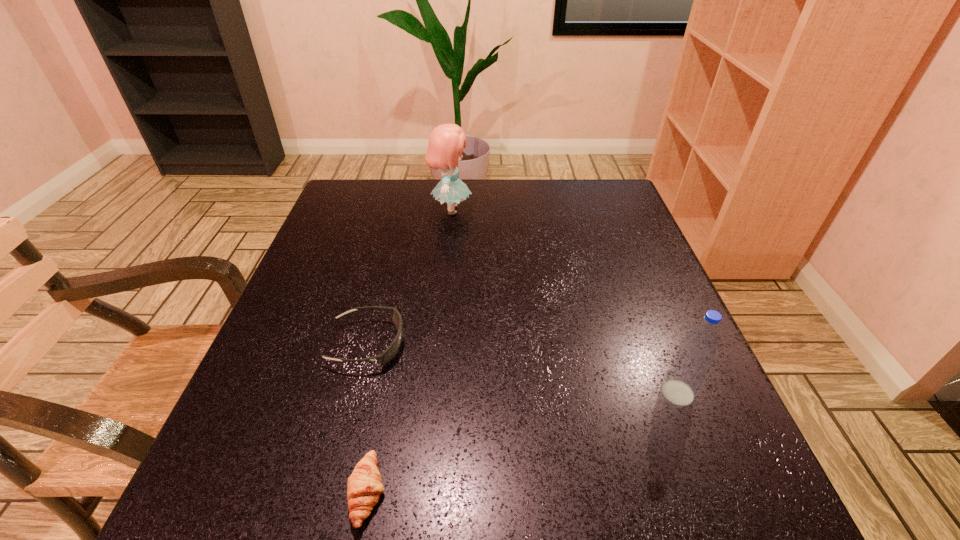
Where is `free space between the water bottle and the tallest object`? The width and height of the screenshot is (960, 540). free space between the water bottle and the tallest object is located at coordinates (564, 301).

Locate an element on the screen. The width and height of the screenshot is (960, 540). free space between the rightmost object and the tallest object is located at coordinates (564, 301).

In order to click on unoccupied position between the goggles and the second nearest object in this screenshot , I will do `click(522, 368)`.

Where is `free spot between the farthest object and the second farthest object`? free spot between the farthest object and the second farthest object is located at coordinates (409, 276).

Locate an element on the screen. The image size is (960, 540). free space between the second nearest object and the pastry is located at coordinates (522, 442).

You are a GUI agent. You are given a task and a screenshot of the screen. Output one action in this format:
    pyautogui.click(x=<x>, y=<y>)
    Task: Click on the vacant space that's between the tallest object and the goggles
    The height and width of the screenshot is (540, 960).
    Given the screenshot: What is the action you would take?
    pyautogui.click(x=409, y=276)

This screenshot has width=960, height=540. I want to click on unoccupied position between the third nearest object and the rightmost object, so click(522, 368).

You are a GUI agent. You are given a task and a screenshot of the screen. Output one action in this format:
    pyautogui.click(x=<x>, y=<y>)
    Task: Click on the vacant area that lies between the tallest object and the nearest object
    The width and height of the screenshot is (960, 540).
    Given the screenshot: What is the action you would take?
    pyautogui.click(x=409, y=351)

The image size is (960, 540). I want to click on unoccupied area between the second nearest object and the shortest object, so click(522, 442).

Identify the location of free space between the water bottle and the shortest object. This screenshot has height=540, width=960. (522, 442).